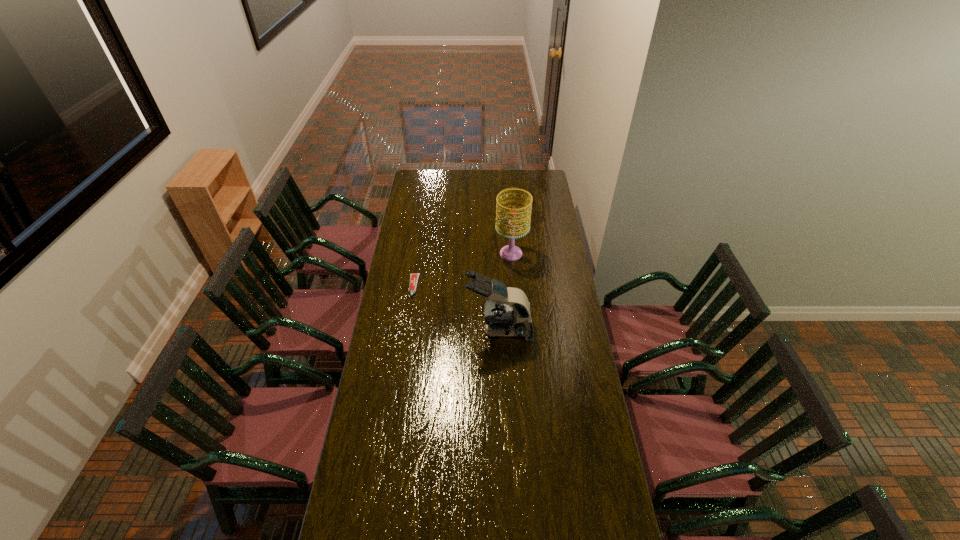
The height and width of the screenshot is (540, 960). I want to click on free space that satisfies the following two spatial constraints: 1. on the front side of the farthest object; 2. through the eyepieces of the nearest object, so click(517, 330).

Locate an element on the screen. blank area in the image that satisfies the following two spatial constraints: 1. on the front side of the lampshade; 2. through the eyepieces of the microscope is located at coordinates (517, 330).